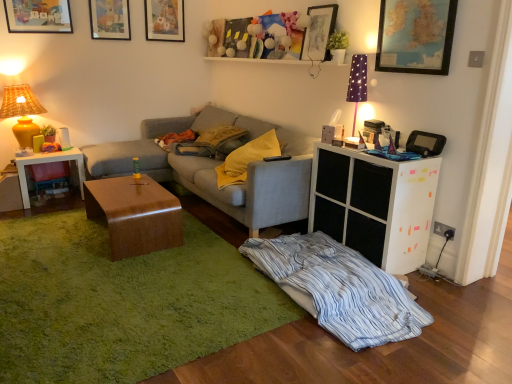
What are the coordinates of `vacant area that is in front of glossy wood coffee table at center` in the screenshot? It's located at (120, 272).